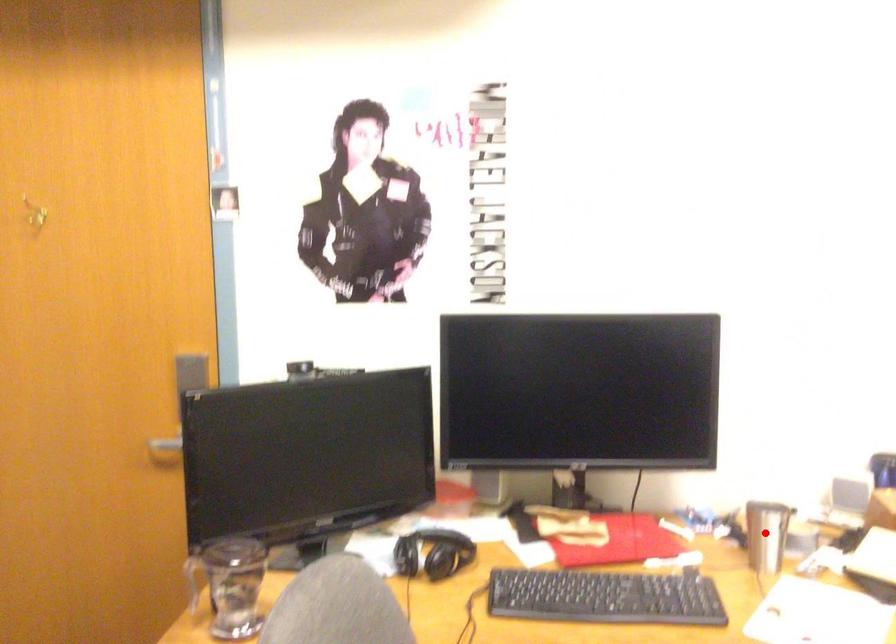
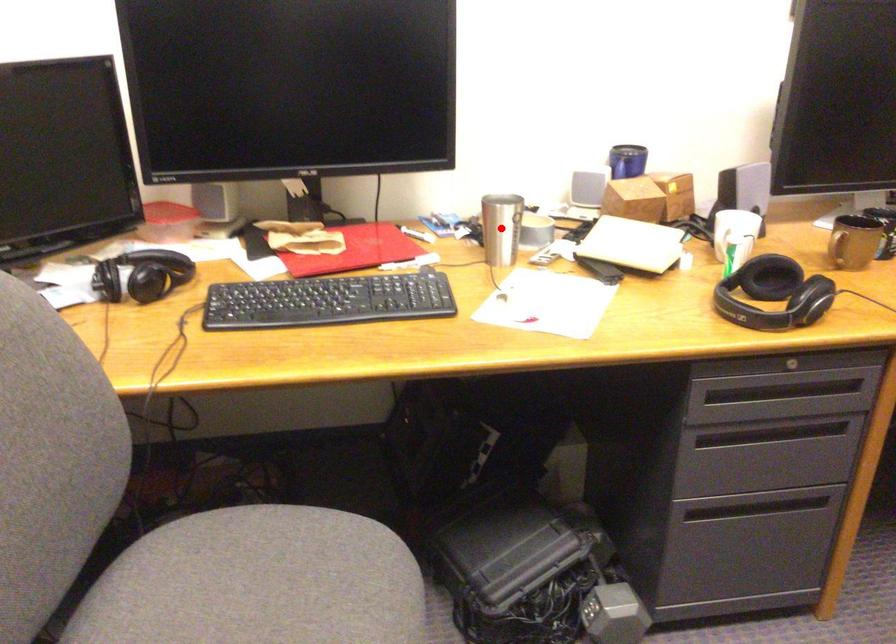
I am providing you with two images of the same scene from different viewpoints. A red point is marked on the first image and another point is marked on the second image. Do the highlighted points in image1 and image2 indicate the same real-world spot?

Yes